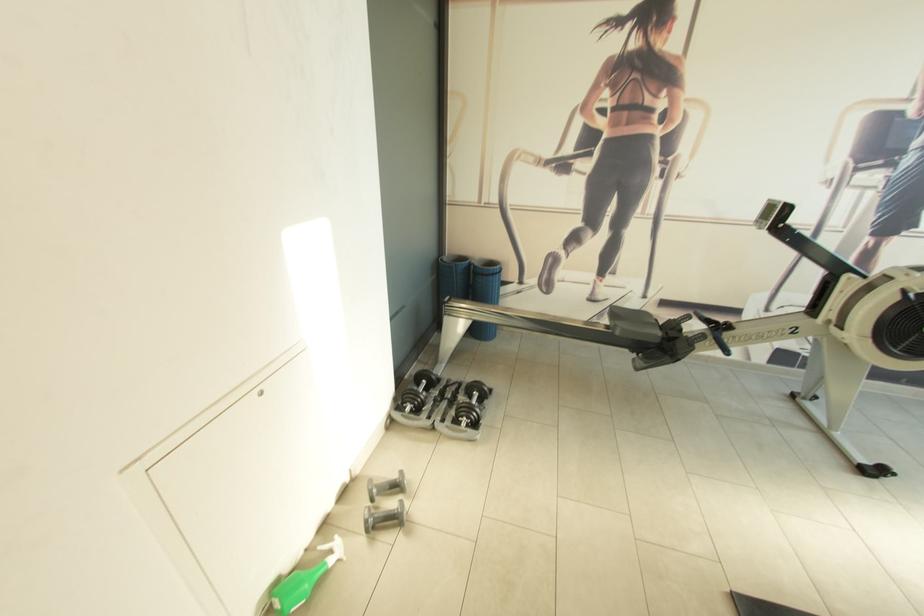
Find where to lift the green spray bottle. Please return your answer as a coordinate pair (x, y).

(304, 580)